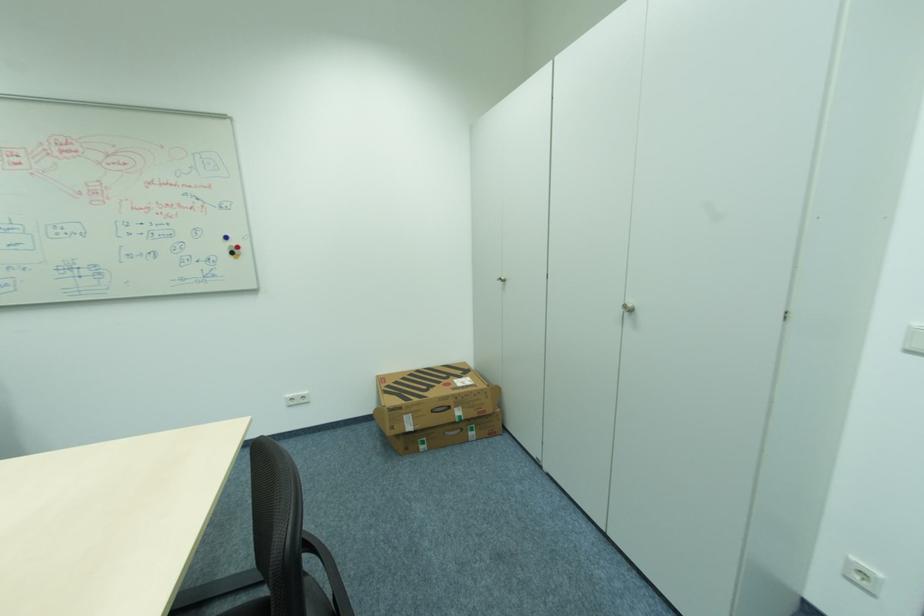
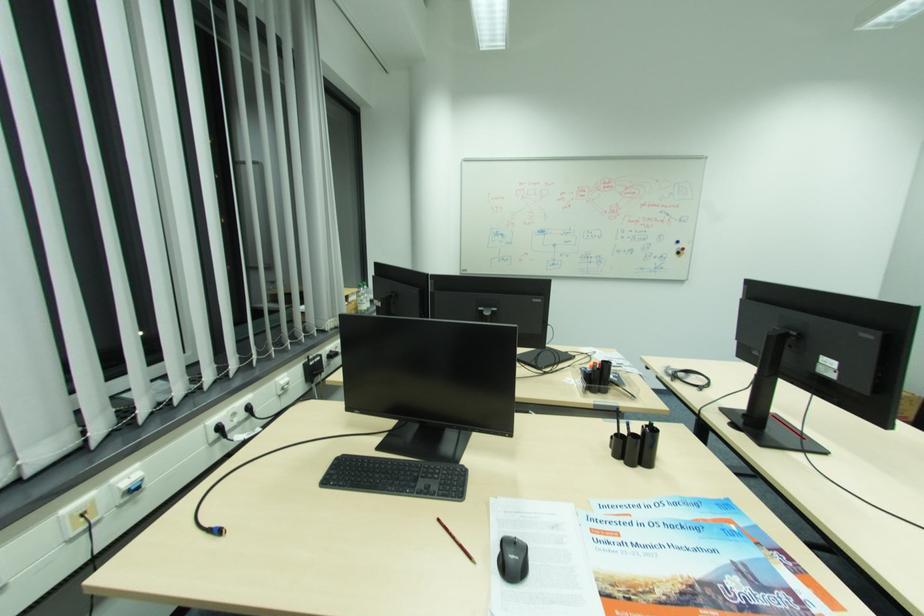
The point at (237, 254) is marked in the first image. Where is the corresponding point in the second image?

(684, 253)